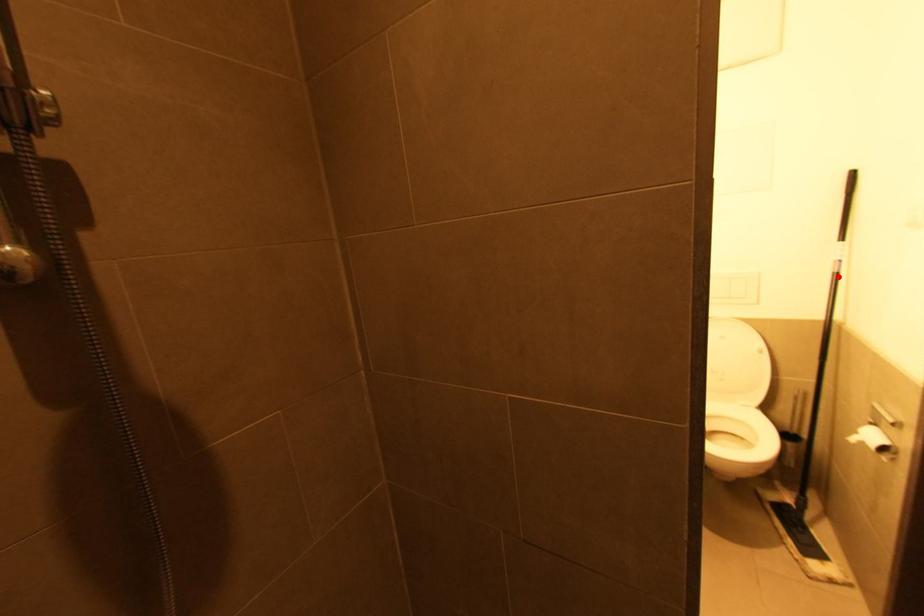
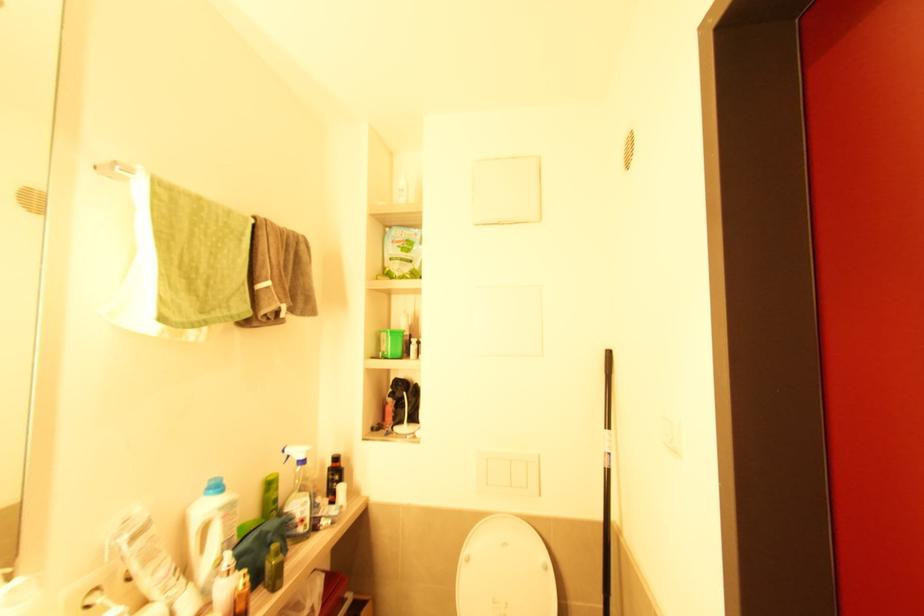
In the second image, find the point that corresponds to the highlighted location in the first image.

(610, 472)